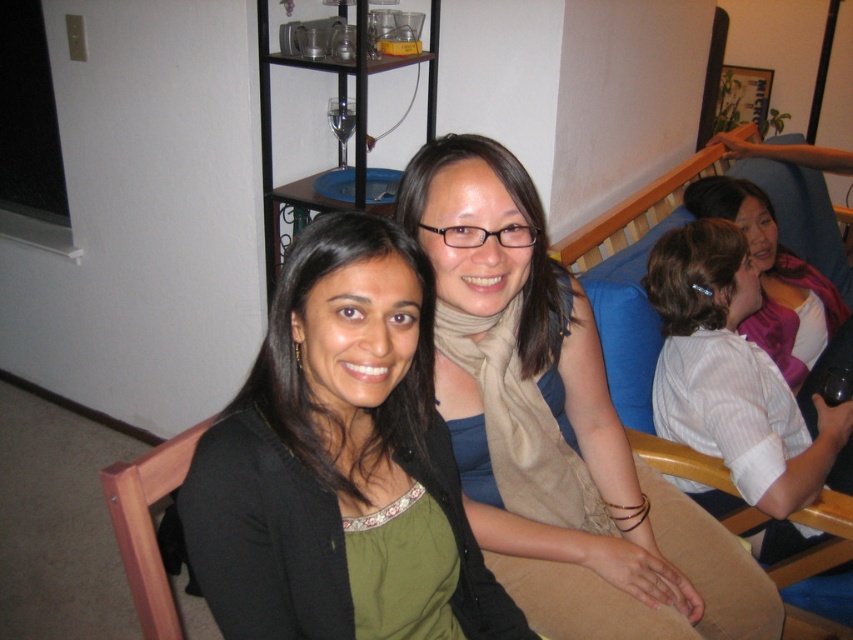
Can you confirm if white striped shirt at right is bigger than pink fabric scarf at upper right?

No, white striped shirt at right is not bigger than pink fabric scarf at upper right.

Can you confirm if white striped shirt at right is positioned to the right of pink fabric scarf at upper right?

No, white striped shirt at right is not to the right of pink fabric scarf at upper right.

Image resolution: width=853 pixels, height=640 pixels. What are the coordinates of `white striped shirt at right` in the screenshot? It's located at point(734,384).

Can you confirm if beige scarf at center is wider than white striped shirt at right?

Correct, the width of beige scarf at center exceeds that of white striped shirt at right.

Which of these two, beige scarf at center or white striped shirt at right, stands taller?

beige scarf at center

The height and width of the screenshot is (640, 853). I want to click on beige scarf at center, so click(556, 428).

Based on the photo, does matte black sweater at center have a greater width compared to pink fabric scarf at upper right?

No.

Which is behind, point (431, 392) or point (819, 280)?

The point (819, 280) is behind.

The width and height of the screenshot is (853, 640). What are the coordinates of `matte black sweater at center` in the screenshot? It's located at (339, 461).